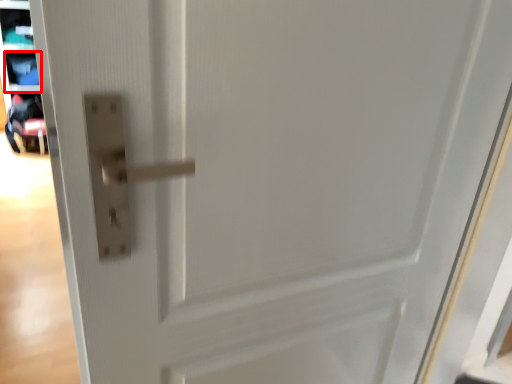
Question: Observing the image, what is the correct spatial positioning of shelf (annotated by the red box) in reference to baby carriage?

Choices:
 (A) left
 (B) right

Answer: (A)